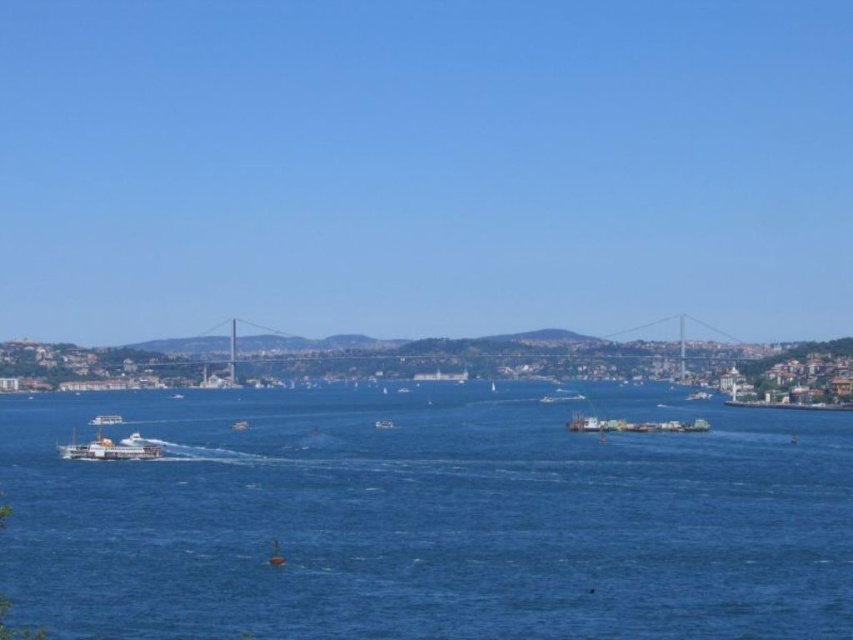
You are a photographer standing on the deck of the white plastic boat at center. You want to take a photo of the blue water at center. Based on their relative sizes, which object should appear larger in your photo?

The blue water at center is much taller than the white plastic boat at center, so the blue water at center will appear larger in the photo.

You are standing at the point labeled as point (427, 518) in the image. What is the immediate environment around this point?

The point (427, 518) corresponds to blue water at center, so the immediate environment around this point is blue water at center.

You are standing on the suspension bridge and looking down. Which direction should you look to see the blue water at center?

You should look downward toward the center of the image to see the blue water at center, as it is located at point coordinates of (x=427, y=518).